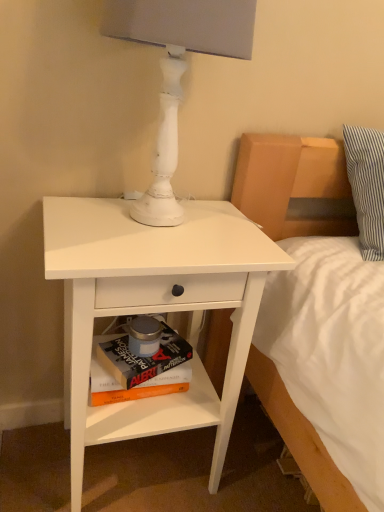
Question: Is hardcover book at lower center, arranged as the 2th paperback book when viewed from the top, to the left or to the right of white painted wood table lamp at upper center in the image?

Choices:
 (A) right
 (B) left

Answer: (B)

Question: In the image, is hardcover book at lower center, positioned as the 1th paperback book in bottom-to-top order, positioned in front of or behind white painted wood table lamp at upper center?

Choices:
 (A) front
 (B) behind

Answer: (B)

Question: Estimate the real-world distances between objects in this image. Which object is farther from the hardcover book at lower center, arranged as the 2th paperback book when viewed from the top?

Choices:
 (A) white matte nightstand at lower left
 (B) hardcover book at lower center, the 2th paperback book in the bottom-to-top sequence
 (C) white painted wood table lamp at upper center

Answer: (C)

Question: Which is nearer to the white matte nightstand at lower left?

Choices:
 (A) white painted wood table lamp at upper center
 (B) hardcover book at lower center, positioned as the 1th paperback book in top-to-bottom order
 (C) hardcover book at lower center, arranged as the 2th paperback book when viewed from the top

Answer: (B)